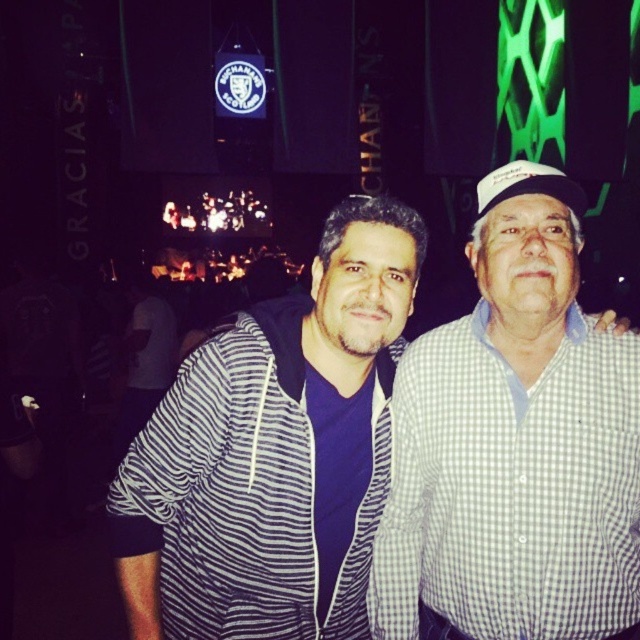
Question: Which point appears closest to the camera in this image?

Choices:
 (A) (456, 403)
 (B) (230, 369)
 (C) (502, 166)

Answer: (B)

Question: Considering the relative positions of white checkered shirt at right and white fabric baseball cap at upper right in the image provided, where is white checkered shirt at right located with respect to white fabric baseball cap at upper right?

Choices:
 (A) left
 (B) right

Answer: (A)

Question: Which object is the closest to the white fabric baseball cap at upper right?

Choices:
 (A) striped hoodie at center
 (B) white checkered shirt at right
 (C) striped fabric shirt at center

Answer: (B)

Question: Is striped hoodie at center wider than white checkered shirt at right?

Choices:
 (A) yes
 (B) no

Answer: (A)

Question: Among these points, which one is nearest to the camera?

Choices:
 (A) (568, 316)
 (B) (202, 428)
 (C) (552, 182)
 (D) (112, 497)

Answer: (B)

Question: Does striped hoodie at center appear on the left side of white checkered shirt at right?

Choices:
 (A) yes
 (B) no

Answer: (A)